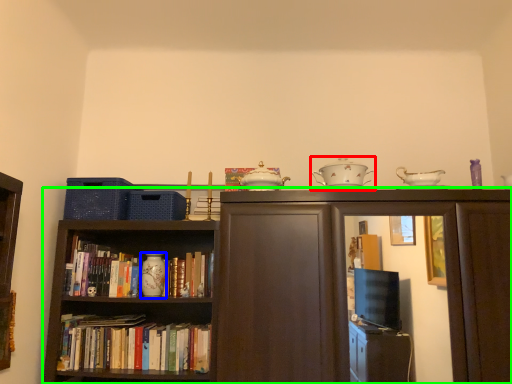
Question: Estimate the real-world distances between objects in this image. Which object is farther from tableware (highlighted by a red box), tableware (highlighted by a blue box) or bookcase (highlighted by a green box)?

Choices:
 (A) tableware
 (B) bookcase

Answer: (A)